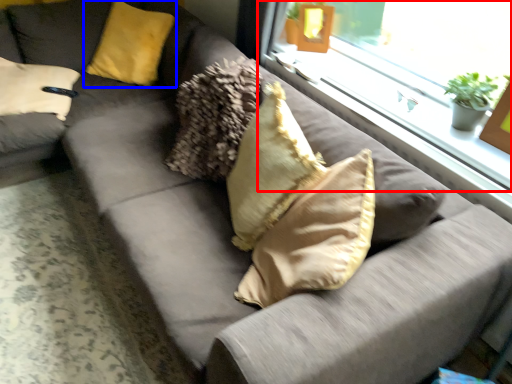
Question: Among these objects, which one is farthest to the camera, window (highlighted by a red box) or pillow (highlighted by a blue box)?

Choices:
 (A) window
 (B) pillow

Answer: (B)